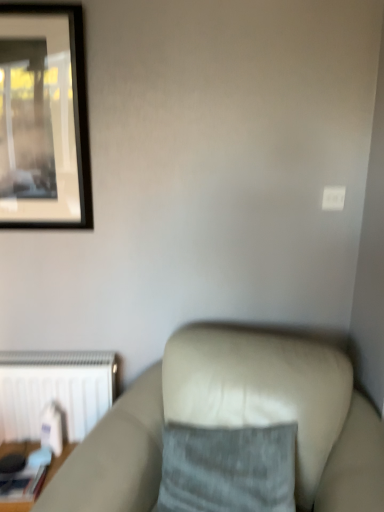
The height and width of the screenshot is (512, 384). I want to click on suede-like beige couch at lower right, so click(x=232, y=420).

I want to click on radiator above the wooden table at lower left (from the image's perspective), so click(54, 391).

Does point (22, 451) lie in front of point (108, 382)?

Yes, it is.

Which object is further away from the camera, wooden table at lower left or white matte radiator at lower left?

Positioned behind is white matte radiator at lower left.

Is point (17, 433) positioned behind point (51, 476)?

Yes, it is behind point (51, 476).

Considering the sizes of objects white matte radiator at lower left and wooden table at lower left in the image provided, who is bigger, white matte radiator at lower left or wooden table at lower left?

white matte radiator at lower left is bigger.

Between white matte radiator at lower left and wooden table at lower left, which one has larger width?

wooden table at lower left is wider.

Can you tell me how much gray fabric pillow at center and suede-like beige couch at lower right differ in facing direction?

The angle between the facing direction of gray fabric pillow at center and the facing direction of suede-like beige couch at lower right is 10.4 degrees.

Which object is more forward, gray fabric pillow at center or suede-like beige couch at lower right?

suede-like beige couch at lower right is in front.

Is gray fabric pillow at center directly adjacent to suede-like beige couch at lower right?

No, gray fabric pillow at center is not with suede-like beige couch at lower right.

Is gray fabric pillow at center surrounding suede-like beige couch at lower right?

No, suede-like beige couch at lower right is not inside gray fabric pillow at center.

Is white matte radiator at lower left positioned with its back to gray fabric pillow at center?

No.

Is white matte radiator at lower left not close to gray fabric pillow at center?

white matte radiator at lower left is actually quite close to gray fabric pillow at center.

From a real-world perspective, is white matte radiator at lower left below gray fabric pillow at center?

Yes, from a real-world perspective, white matte radiator at lower left is below gray fabric pillow at center.

Consider the image. Is gray fabric pillow at center inside white matte radiator at lower left?

No.

Considering the relative positions of suede-like beige couch at lower right and wooden table at lower left in the image provided, is suede-like beige couch at lower right to the left or to the right of wooden table at lower left?

suede-like beige couch at lower right is positioned on wooden table at lower left's right side.

The width and height of the screenshot is (384, 512). What are the coordinates of `table lying behind the suede-like beige couch at lower right` in the screenshot? It's located at (18, 447).

Is suede-like beige couch at lower right completely or partially outside of wooden table at lower left?

suede-like beige couch at lower right lies outside wooden table at lower left's area.

Between suede-like beige couch at lower right and wooden table at lower left, which one has larger size?

Bigger between the two is suede-like beige couch at lower right.

From their relative heights in the image, would you say wooden table at lower left is taller or shorter than gray fabric pillow at center?

wooden table at lower left is taller than gray fabric pillow at center.

Based on the photo, from the image's perspective, which one is positioned higher, wooden table at lower left or gray fabric pillow at center?

gray fabric pillow at center, from the image's perspective.

Is wooden table at lower left placed right next to gray fabric pillow at center?

There is a gap between wooden table at lower left and gray fabric pillow at center.

Is point (27, 450) closer to viewer compared to point (203, 505)?

No, it is not.

Considering the positions of point (366, 465) and point (15, 403), is point (366, 465) closer or farther from the camera than point (15, 403)?

Clearly, point (366, 465) is closer to the camera than point (15, 403).

From the picture: Which object is positioned more to the right, suede-like beige couch at lower right or white matte radiator at lower left?

suede-like beige couch at lower right is more to the right.

Is suede-like beige couch at lower right facing towards white matte radiator at lower left?

No.

From a real-world perspective, relative to white matte radiator at lower left, is suede-like beige couch at lower right vertically above or below?

From a real-world perspective, suede-like beige couch at lower right is physically below white matte radiator at lower left.

Where is `radiator on the right of wooden table at lower left`? radiator on the right of wooden table at lower left is located at coordinates (54, 391).

The height and width of the screenshot is (512, 384). In order to click on radiator behind the wooden table at lower left in this screenshot , I will do `click(54, 391)`.

Looking at this image, looking at the image, which one is located closer to white matte radiator at lower left, suede-like beige couch at lower right or wooden table at lower left?

Based on the image, wooden table at lower left appears to be nearer to white matte radiator at lower left.

Consider the image. Based on their spatial positions, is white matte radiator at lower left or wooden table at lower left closer to gray fabric pillow at center?

wooden table at lower left is positioned closer to the anchor gray fabric pillow at center.

When comparing their distances from wooden table at lower left, does white matte radiator at lower left or gray fabric pillow at center seem further?

gray fabric pillow at center is positioned further to the anchor wooden table at lower left.

Estimate the real-world distances between objects in this image. Which object is further from gray fabric pillow at center, white matte radiator at lower left or suede-like beige couch at lower right?

The object further to gray fabric pillow at center is white matte radiator at lower left.

Consider the image. Which object lies nearer to the anchor point white matte radiator at lower left, gray fabric pillow at center or suede-like beige couch at lower right?

Among the two, suede-like beige couch at lower right is located nearer to white matte radiator at lower left.

From the image, which object appears to be nearer to wooden table at lower left, white matte radiator at lower left or suede-like beige couch at lower right?

Based on the image, white matte radiator at lower left appears to be nearer to wooden table at lower left.

Looking at the image, which one is located closer to white matte radiator at lower left, suede-like beige couch at lower right or gray fabric pillow at center?

Based on the image, suede-like beige couch at lower right appears to be nearer to white matte radiator at lower left.

Looking at the image, which one is located closer to suede-like beige couch at lower right, white matte radiator at lower left or gray fabric pillow at center?

Among the two, gray fabric pillow at center is located nearer to suede-like beige couch at lower right.

You are a GUI agent. You are given a task and a screenshot of the screen. Output one action in this format:
    pyautogui.click(x=<x>, y=<y>)
    Task: Click on the pillow located between wooden table at lower left and suede-like beige couch at lower right in the left-right direction
    This screenshot has height=512, width=384.
    Given the screenshot: What is the action you would take?
    pyautogui.click(x=228, y=469)

Where is `table between suede-like beige couch at lower right and white matte radiator at lower left from front to back`? table between suede-like beige couch at lower right and white matte radiator at lower left from front to back is located at coordinates (18, 447).

At what (x,y) coordinates should I click in order to perform the action: click on pillow positioned between suede-like beige couch at lower right and white matte radiator at lower left from near to far. Please return your answer as a coordinate pair (x, y). This screenshot has height=512, width=384. Looking at the image, I should click on (228, 469).

I want to click on radiator situated between wooden table at lower left and gray fabric pillow at center from left to right, so click(x=54, y=391).